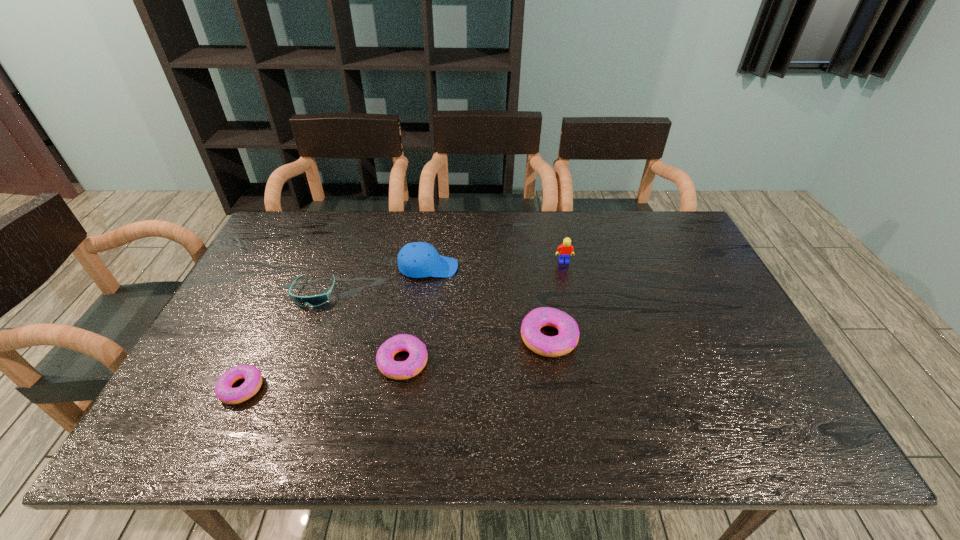
At what (x,y) coordinates should I click in order to perform the action: click on unoccupied position between the cap and the Lego. Please return your answer as a coordinate pair (x, y). Looking at the image, I should click on (496, 265).

Identify which object is located as the fifth nearest to the leftmost doughnut. Please provide its 2D coordinates. Your answer should be formatted as a tuple, i.e. [(x, y)], where the tuple contains the x and y coordinates of a point satisfying the conditions above.

[(566, 249)]

This screenshot has width=960, height=540. I want to click on object that is the fourth nearest to the second doughnut from right to left, so click(x=225, y=393).

Choose which doughnut is the second nearest neighbor to the second tallest doughnut. Please provide its 2D coordinates. Your answer should be formatted as a tuple, i.e. [(x, y)], where the tuple contains the x and y coordinates of a point satisfying the conditions above.

[(225, 393)]

Image resolution: width=960 pixels, height=540 pixels. In order to click on doughnut that is the closest one to the cap in this screenshot , I will do `click(549, 346)`.

At what (x,y) coordinates should I click in order to perform the action: click on free region that satisfies the following two spatial constraints: 1. on the front-facing side of the sunglasses; 2. on the left side of the second doughnut from right to left. Please return your answer as a coordinate pair (x, y). This screenshot has width=960, height=540. Looking at the image, I should click on (287, 362).

The height and width of the screenshot is (540, 960). I want to click on vacant point that satisfies the following two spatial constraints: 1. on the front-facing side of the cap; 2. on the front-facing side of the sunglasses, so pos(425,293).

Locate an element on the screen. The width and height of the screenshot is (960, 540). free spot that satisfies the following two spatial constraints: 1. on the front-facing side of the cap; 2. on the front-facing side of the sunglasses is located at coordinates (425, 293).

Where is `free spot that satisfies the following two spatial constraints: 1. on the front-facing side of the Lego; 2. on the front-facing side of the cap`? Image resolution: width=960 pixels, height=540 pixels. free spot that satisfies the following two spatial constraints: 1. on the front-facing side of the Lego; 2. on the front-facing side of the cap is located at coordinates (565, 267).

Locate an element on the screen. The width and height of the screenshot is (960, 540). free location that satisfies the following two spatial constraints: 1. on the front-facing side of the cap; 2. on the front side of the leftmost doughnut is located at coordinates (412, 388).